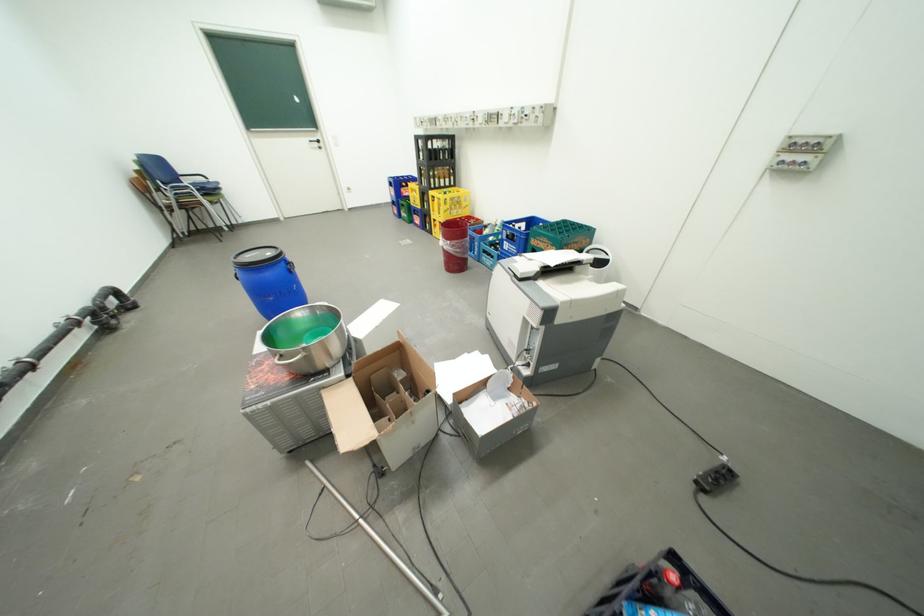
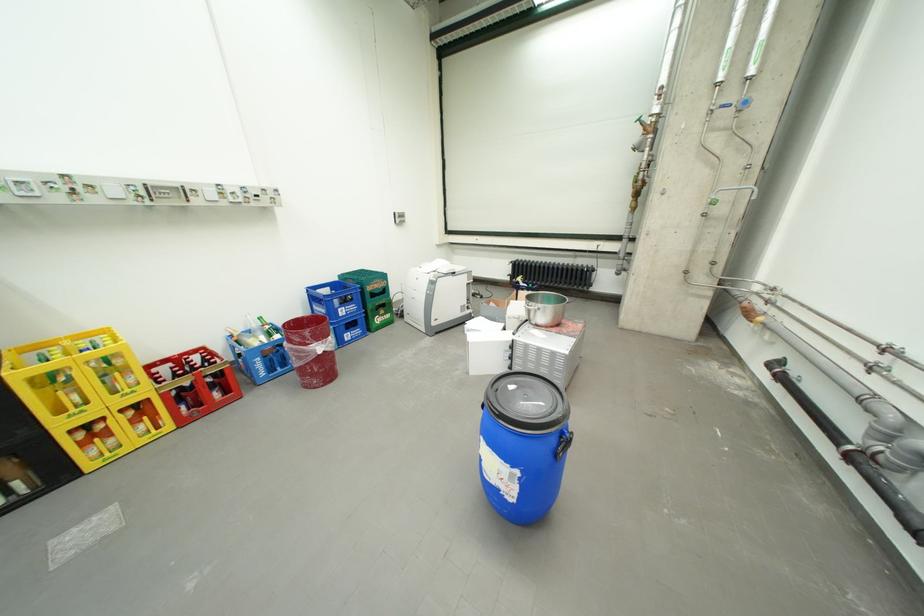
In the second image, find the point that corresponds to point 553,244 in the first image.

(386, 285)